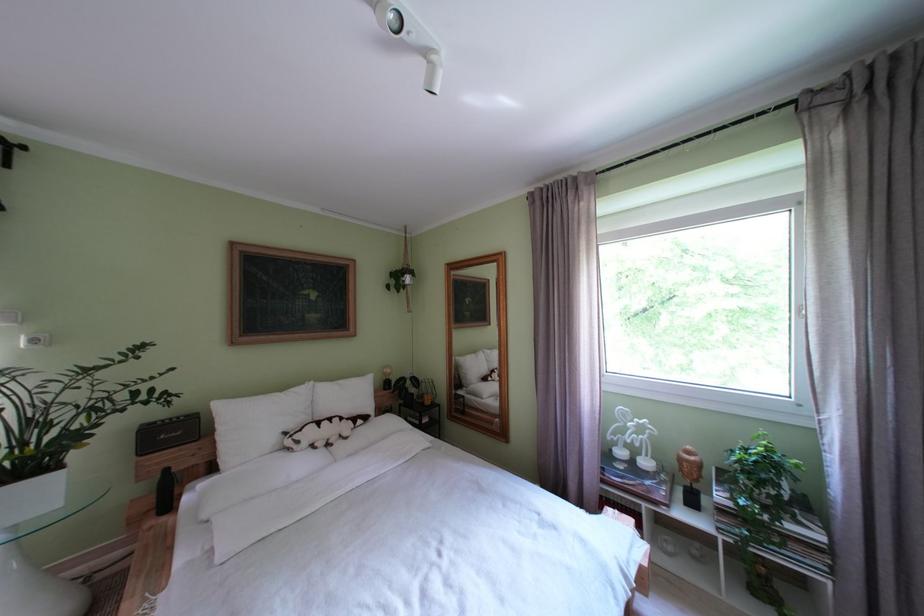
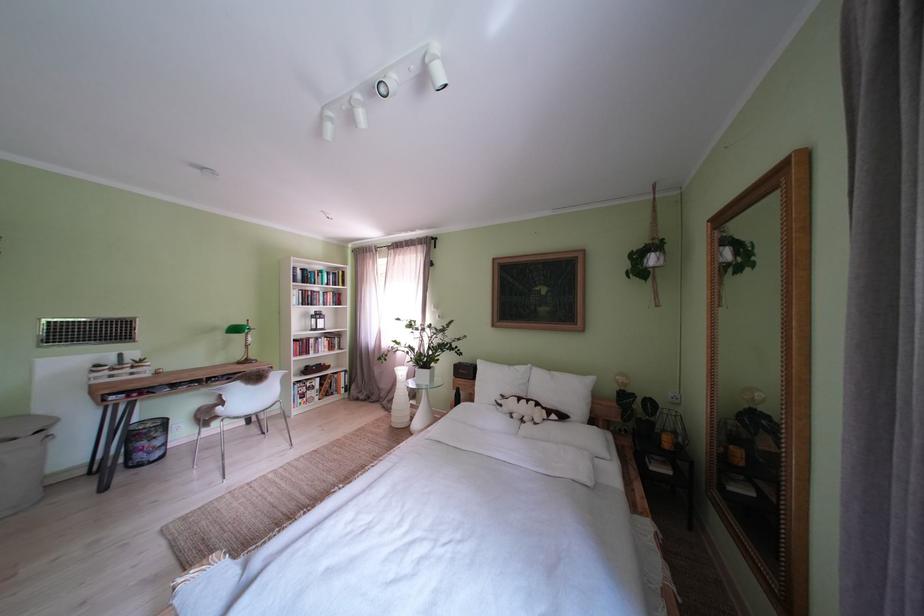
The point at (x=261, y=429) is marked in the first image. Where is the corresponding point in the second image?

(500, 386)